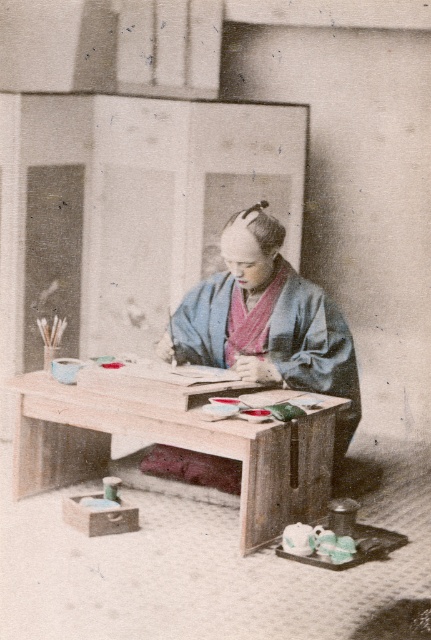
Question: Which point is farther to the camera?

Choices:
 (A) (239, 307)
 (B) (40, 422)

Answer: (A)

Question: Does wooden table at center lie in front of blue silk kimono at center?

Choices:
 (A) no
 (B) yes

Answer: (B)

Question: Which point is farther from the camera taking this photo?

Choices:
 (A) (303, 312)
 (B) (186, 445)

Answer: (A)

Question: Which point is farther to the camera?

Choices:
 (A) blue silk kimono at center
 (B) wooden table at center

Answer: (A)

Question: Is wooden table at center above blue silk kimono at center?

Choices:
 (A) no
 (B) yes

Answer: (A)

Question: Is wooden table at center bigger than blue silk kimono at center?

Choices:
 (A) no
 (B) yes

Answer: (B)